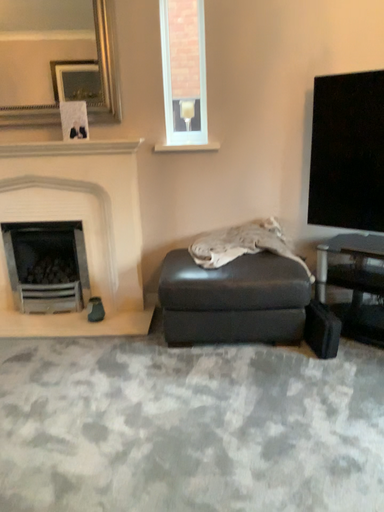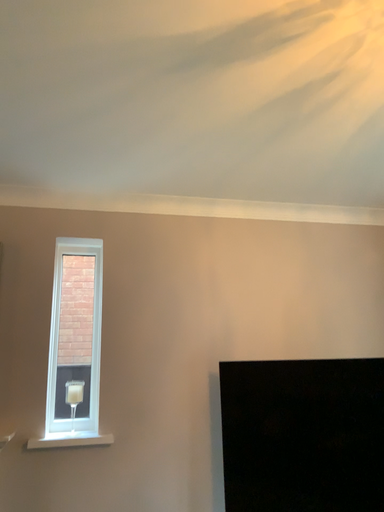
Question: How did the camera likely rotate when shooting the video?

Choices:
 (A) rotated left
 (B) rotated right

Answer: (B)